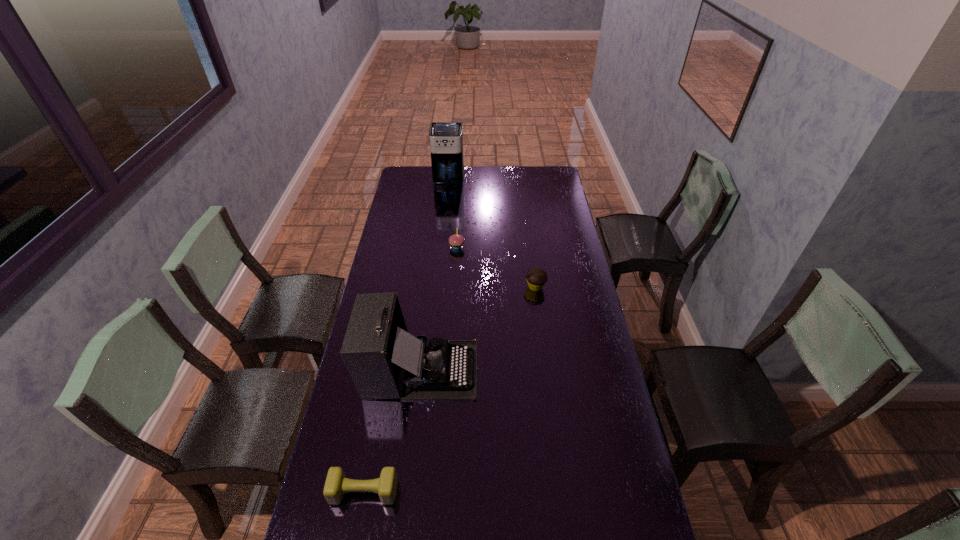
Where is `vacant point located between the coffee maker and the cupcake`? vacant point located between the coffee maker and the cupcake is located at coordinates (453, 214).

The image size is (960, 540). What are the coordinates of `vacant area that lies between the typewriter and the nearest object` in the screenshot? It's located at (393, 430).

This screenshot has height=540, width=960. I want to click on free space between the typewriter and the cupcake, so click(x=439, y=308).

Image resolution: width=960 pixels, height=540 pixels. Identify the location of vacant space that's between the coffee maker and the fourth nearest object. (453, 214).

I want to click on free space between the typewriter and the cupcake, so click(x=439, y=308).

Where is `free spot between the coffee maker and the third farthest object`? free spot between the coffee maker and the third farthest object is located at coordinates (492, 234).

You are a GUI agent. You are given a task and a screenshot of the screen. Output one action in this format:
    pyautogui.click(x=<x>, y=<y>)
    Task: Click on the object identified as the third closest to the third shortest object
    
    Given the screenshot: What is the action you would take?
    pyautogui.click(x=384, y=361)

Identify which object is the second closest to the dumbbell. Please provide its 2D coordinates. Your answer should be formatted as a tuple, i.e. [(x, y)], where the tuple contains the x and y coordinates of a point satisfying the conditions above.

[(536, 277)]

Image resolution: width=960 pixels, height=540 pixels. What are the coordinates of `vacant region that satisfies the following two spatial constraints: 1. on the front panel of the second farthest object; 2. on the left side of the coffee maker` in the screenshot? It's located at (442, 247).

Image resolution: width=960 pixels, height=540 pixels. I want to click on free space that satisfies the following two spatial constraints: 1. on the back side of the nearest object; 2. on the left side of the cupcake, so click(x=410, y=247).